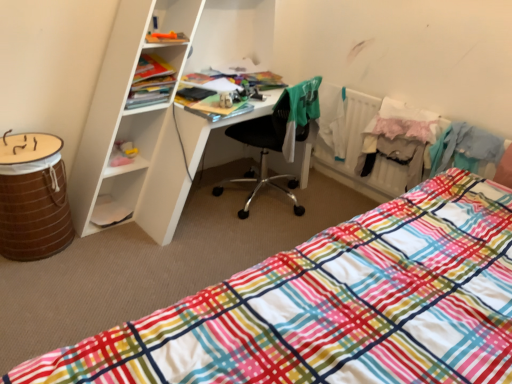
Question: Is plaid fabric bed at lower right behind green fabric shirt at center, which is counted as the 2th clothing, starting from the right?

Choices:
 (A) no
 (B) yes

Answer: (A)

Question: Is plaid fabric bed at lower right not inside green fabric shirt at center, which is counted as the 2th clothing, starting from the right?

Choices:
 (A) yes
 (B) no

Answer: (A)

Question: From the image's perspective, does plaid fabric bed at lower right appear higher than green fabric shirt at center, which is the first clothing from left to right?

Choices:
 (A) yes
 (B) no

Answer: (B)

Question: Is plaid fabric bed at lower right facing towards green fabric shirt at center, which is the first clothing from left to right?

Choices:
 (A) no
 (B) yes

Answer: (B)

Question: Is plaid fabric bed at lower right oriented away from green fabric shirt at center, which is the first clothing from left to right?

Choices:
 (A) no
 (B) yes

Answer: (A)

Question: From a real-world perspective, is brown woven barrel at lower left positioned above or below black plastic chair at center?

Choices:
 (A) below
 (B) above

Answer: (A)

Question: Looking at the image, does brown woven barrel at lower left seem bigger or smaller compared to black plastic chair at center?

Choices:
 (A) small
 (B) big

Answer: (A)

Question: Which is correct: brown woven barrel at lower left is inside black plastic chair at center, or outside of it?

Choices:
 (A) outside
 (B) inside

Answer: (A)

Question: In the image, is brown woven barrel at lower left on the left side or the right side of black plastic chair at center?

Choices:
 (A) left
 (B) right

Answer: (A)

Question: Is plaid fabric bed at lower right to the left or to the right of matte plastic cabinet at upper left in the image?

Choices:
 (A) left
 (B) right

Answer: (B)

Question: From a real-world perspective, relative to matte plastic cabinet at upper left, is plaid fabric bed at lower right vertically above or below?

Choices:
 (A) above
 (B) below

Answer: (B)

Question: In terms of height, does plaid fabric bed at lower right look taller or shorter compared to matte plastic cabinet at upper left?

Choices:
 (A) short
 (B) tall

Answer: (B)

Question: Relative to matte plastic cabinet at upper left, is plaid fabric bed at lower right in front or behind?

Choices:
 (A) front
 (B) behind

Answer: (A)

Question: In terms of width, does brown woven barrel at lower left look wider or thinner when compared to white lace skirt at right, the 1th clothing viewed from the right?

Choices:
 (A) thin
 (B) wide

Answer: (B)

Question: From a real-world perspective, is brown woven barrel at lower left positioned above or below white lace skirt at right, acting as the 2th clothing starting from the left?

Choices:
 (A) above
 (B) below

Answer: (B)